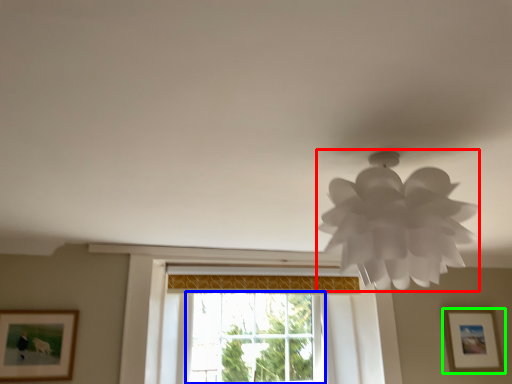
Question: Which is farther away from lamp (highlighted by a red box)? window (highlighted by a blue box) or picture frame (highlighted by a green box)?

Choices:
 (A) window
 (B) picture frame

Answer: (B)